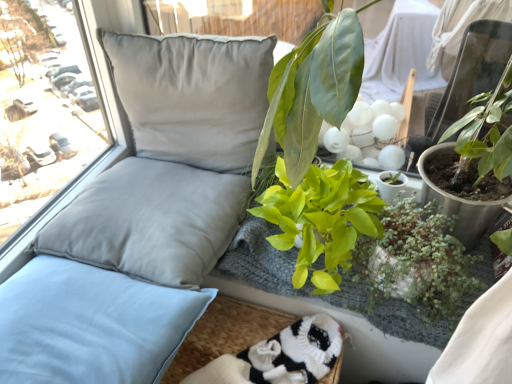
The height and width of the screenshot is (384, 512). I want to click on empty space that is ontop of satin gray pillow at left, which appears as the second pillow when viewed from the top (from a real-world perspective), so click(x=136, y=206).